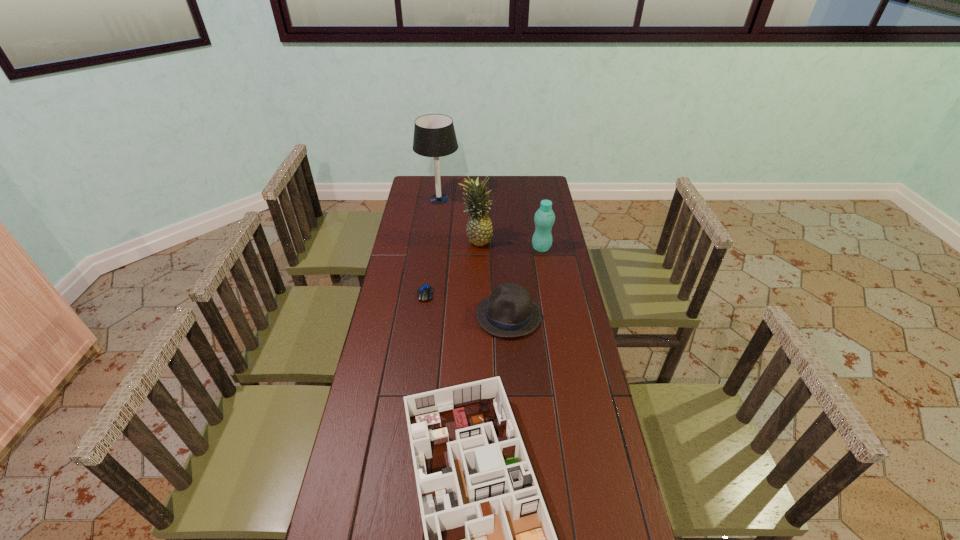
Image resolution: width=960 pixels, height=540 pixels. Identify the location of free space located 0.120m on the front-facing side of the bowler hat. (444, 315).

Where is `blank space located 0.150m on the front-facing side of the bowler hat`? Image resolution: width=960 pixels, height=540 pixels. blank space located 0.150m on the front-facing side of the bowler hat is located at coordinates (435, 315).

I want to click on free space located 0.110m on the button side of the computer mouse, so click(421, 324).

Locate an element on the screen. This screenshot has width=960, height=540. object located at the far edge is located at coordinates (434, 135).

The width and height of the screenshot is (960, 540). What are the coordinates of `table lamp at the left edge` in the screenshot? It's located at (434, 135).

At what (x,y) coordinates should I click in order to perform the action: click on computer mouse that is at the left edge. Please return your answer as a coordinate pair (x, y). This screenshot has width=960, height=540. Looking at the image, I should click on click(424, 293).

I want to click on bottle that is at the right edge, so click(x=544, y=218).

Find the location of `bowler hat that is at the right edge`. bowler hat that is at the right edge is located at coordinates (509, 312).

Locate an element on the screen. object situated at the far left corner is located at coordinates (434, 135).

Locate an element on the screen. Image resolution: width=960 pixels, height=540 pixels. vacant space at the far edge of the desktop is located at coordinates (465, 197).